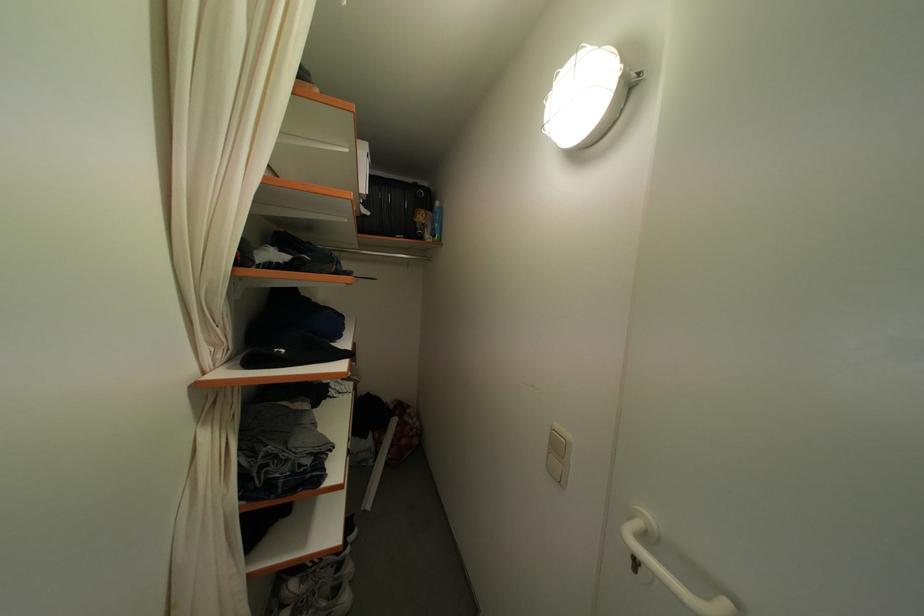
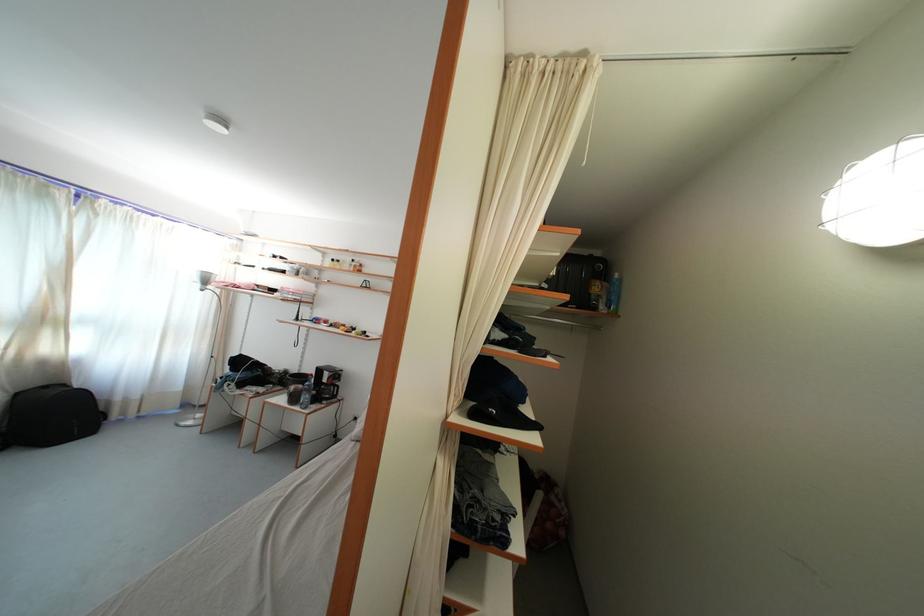
Question: The camera is either moving clockwise (left) or counter-clockwise (right) around the object. The first image is from the beginning of the video and the second image is from the end. Is the camera moving left or right when shooting the video?

Choices:
 (A) Left
 (B) Right

Answer: (B)